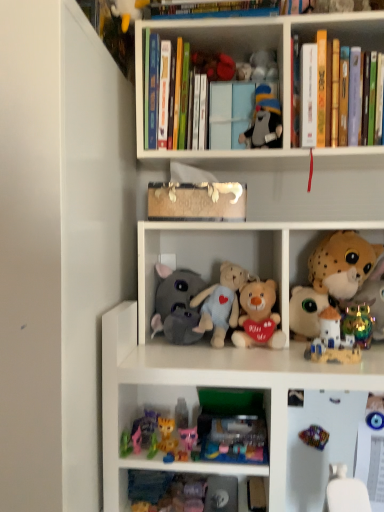
Question: Is soft plush toys at center, which appears as the first shelf when ordered from the bottom, behind wooden toy at center, the third book positioned from the right?

Choices:
 (A) yes
 (B) no

Answer: (B)

Question: From a real-world perspective, is soft plush toys at center, the second shelf in the top-to-bottom sequence, located beneath wooden toy at center, the third book positioned from the right?

Choices:
 (A) yes
 (B) no

Answer: (A)

Question: Is soft plush toys at center, which appears as the first shelf when ordered from the bottom, outside wooden toy at center, the third book positioned from the right?

Choices:
 (A) no
 (B) yes

Answer: (B)

Question: Can you confirm if soft plush toys at center, the second shelf in the top-to-bottom sequence, is positioned to the right of wooden toy at center, the third book positioned from the right?

Choices:
 (A) no
 (B) yes

Answer: (B)

Question: From the image's perspective, is soft plush toys at center, the second shelf in the top-to-bottom sequence, below wooden toy at center, the 1th book when ordered from left to right?

Choices:
 (A) no
 (B) yes

Answer: (B)

Question: Is soft plush toys at center, which appears as the first shelf when ordered from the bottom, aimed at wooden toy at center, the third book positioned from the right?

Choices:
 (A) no
 (B) yes

Answer: (A)

Question: Is wooden toy at center, the 1th book when ordered from left to right, positioned with its back to gray fabric stuffed animal at upper center, marked as the ninth toy in a bottom-to-top arrangement?

Choices:
 (A) no
 (B) yes

Answer: (A)

Question: Would you say wooden toy at center, the 1th book when ordered from left to right, contains gray fabric stuffed animal at upper center, marked as the ninth toy in a bottom-to-top arrangement?

Choices:
 (A) yes
 (B) no

Answer: (B)

Question: Considering the relative sizes of wooden toy at center, the 1th book when ordered from left to right, and gray fabric stuffed animal at upper center, marked as the ninth toy in a bottom-to-top arrangement, in the image provided, is wooden toy at center, the 1th book when ordered from left to right, bigger than gray fabric stuffed animal at upper center, marked as the ninth toy in a bottom-to-top arrangement,?

Choices:
 (A) no
 (B) yes

Answer: (B)

Question: Is wooden toy at center, the 1th book when ordered from left to right, taller than gray fabric stuffed animal at upper center, positioned as the first toy in top-to-bottom order?

Choices:
 (A) yes
 (B) no

Answer: (B)

Question: Does wooden toy at center, the third book positioned from the right, have a greater width compared to gray fabric stuffed animal at upper center, marked as the ninth toy in a bottom-to-top arrangement?

Choices:
 (A) no
 (B) yes

Answer: (B)

Question: Can you confirm if wooden toy at center, the 1th book when ordered from left to right, is smaller than gray fabric stuffed animal at upper center, marked as the ninth toy in a bottom-to-top arrangement?

Choices:
 (A) no
 (B) yes

Answer: (A)

Question: Does soft plush toys at center, which appears as the first shelf when ordered from the bottom, have a greater height compared to gray fabric stuffed animal at upper center, marked as the ninth toy in a bottom-to-top arrangement?

Choices:
 (A) no
 (B) yes

Answer: (B)